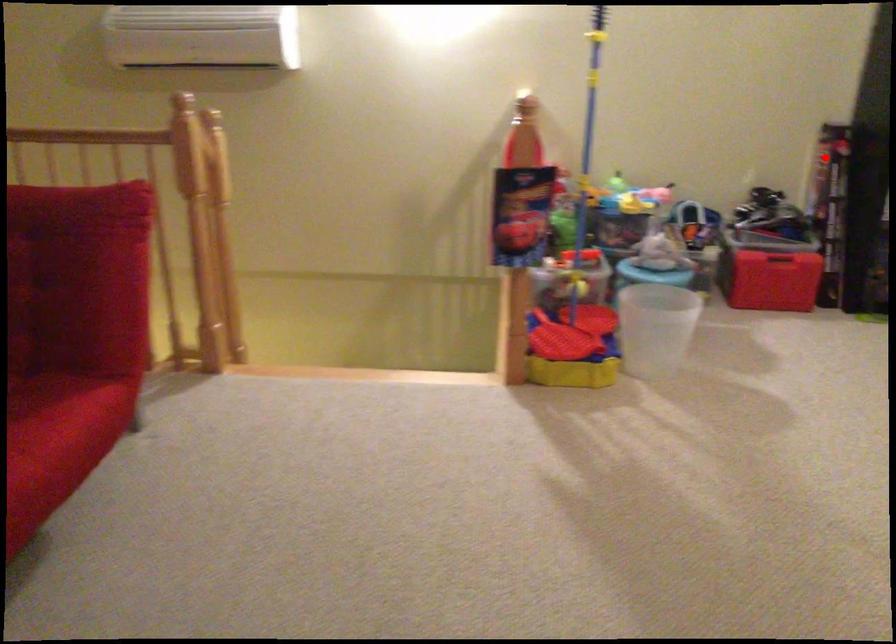
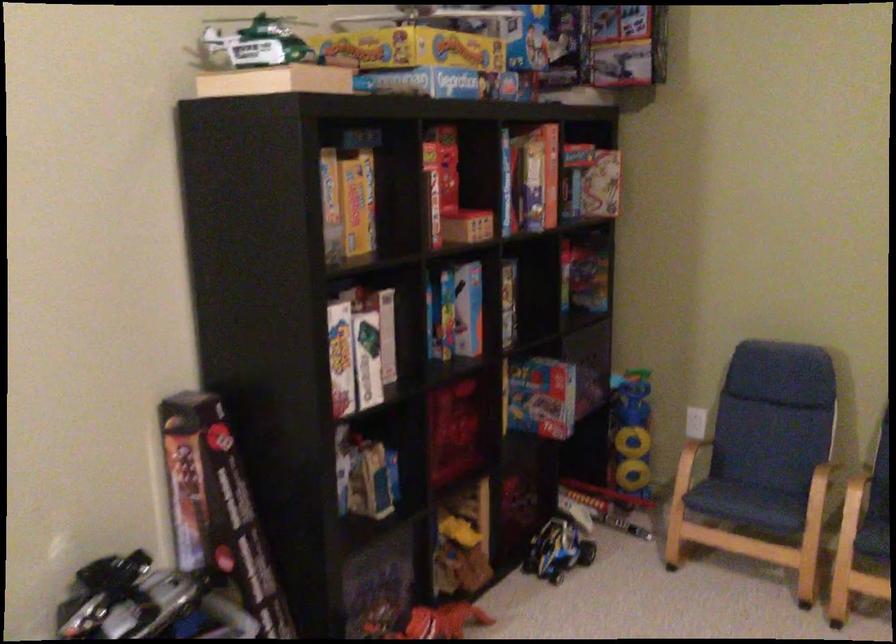
Question: I am providing you with two images of the same scene from different viewpoints. A red point is shown in image1. For the corresponding object point in image2, is it positioned nearer or farther from the camera?

Choices:
 (A) Nearer
 (B) Farther

Answer: (A)